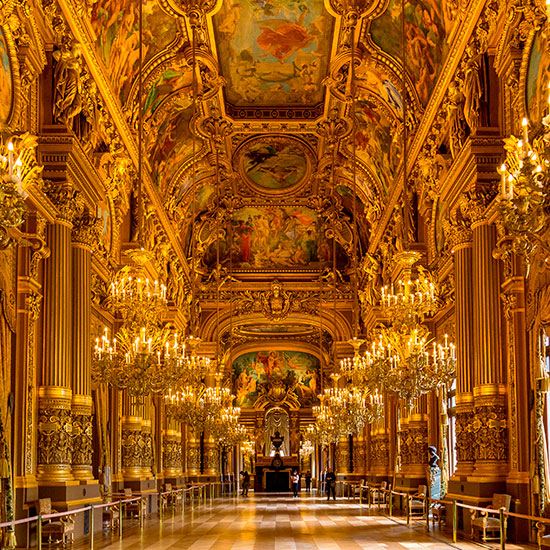
Locate an element on the screen. Image resolution: width=550 pixels, height=550 pixels. window is located at coordinates (452, 434).